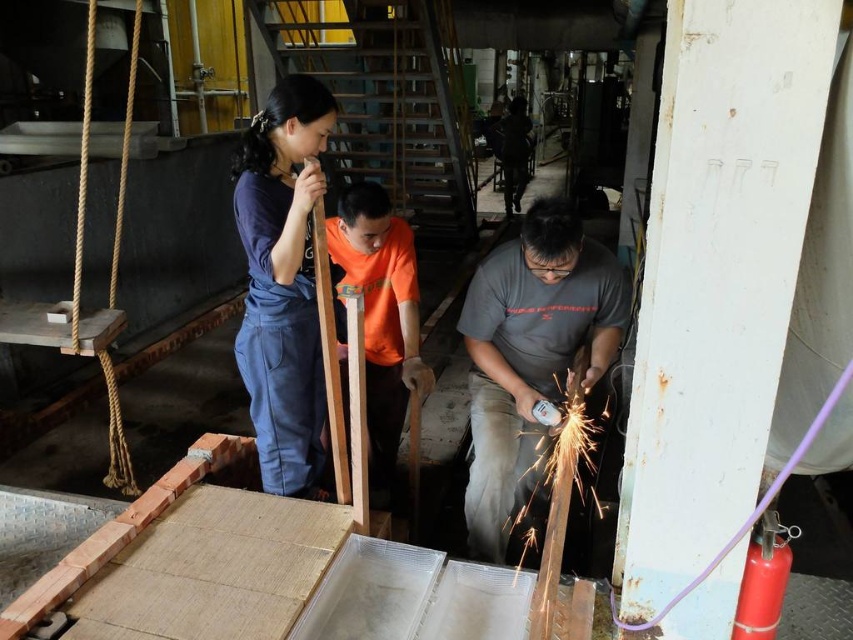
Is the position of matte gray shirt at center more distant than that of orange cotton shirt at center?

That is False.

The height and width of the screenshot is (640, 853). Describe the element at coordinates (531, 356) in the screenshot. I see `matte gray shirt at center` at that location.

Does point (550, 282) come closer to viewer compared to point (343, 348)?

Yes.

Where is `matte gray shirt at center`? This screenshot has width=853, height=640. matte gray shirt at center is located at coordinates (531, 356).

Can you confirm if dark blue denim jumpsuit at center is wider than orange cotton shirt at center?

In fact, dark blue denim jumpsuit at center might be narrower than orange cotton shirt at center.

Which is in front, point (292, 432) or point (380, 461)?

Point (292, 432) is in front.

Locate an element on the screen. dark blue denim jumpsuit at center is located at coordinates (283, 282).

From the picture: Does matte gray shirt at center appear over dark blue denim jumpsuit at center?

Actually, matte gray shirt at center is below dark blue denim jumpsuit at center.

Consider the image. Does matte gray shirt at center come behind dark blue denim jumpsuit at center?

Yes, matte gray shirt at center is behind dark blue denim jumpsuit at center.

Image resolution: width=853 pixels, height=640 pixels. Identify the location of matte gray shirt at center. point(531,356).